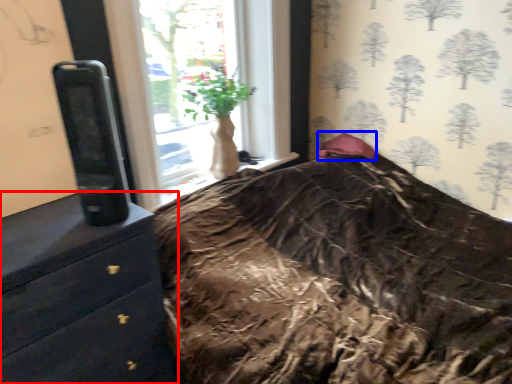
Question: Which point is further to the camera, chest of drawers (highlighted by a red box) or pillow (highlighted by a blue box)?

Choices:
 (A) chest of drawers
 (B) pillow

Answer: (B)